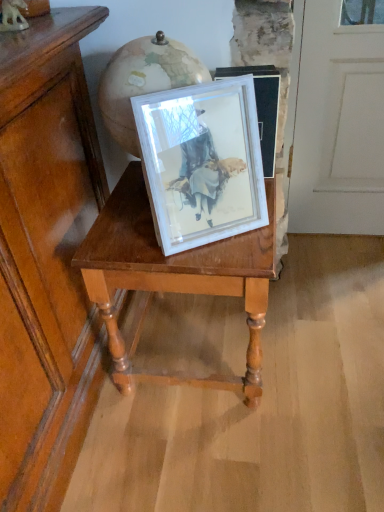
Identify the location of free space in front of white matte picture frame at center. (216, 258).